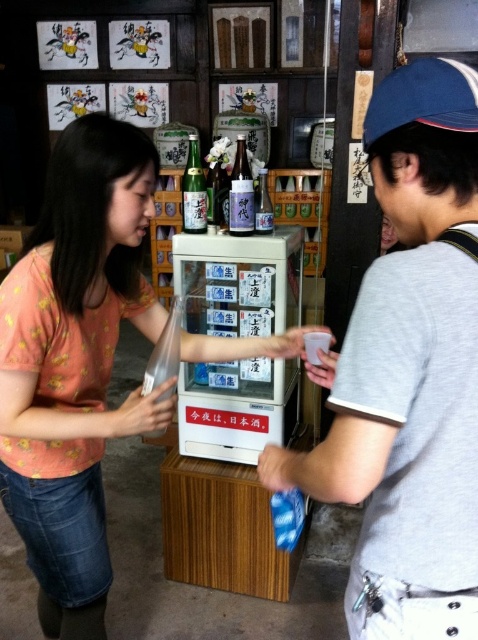
Question: Does matte glass bottle at center have a greater width compared to shiny silver bottle at center?

Choices:
 (A) yes
 (B) no

Answer: (B)

Question: Which point is farther to the camera?

Choices:
 (A) (458, 72)
 (B) (191, 189)
 (C) (421, 115)
 (D) (269, 195)

Answer: (D)

Question: Is gray cotton t-shirt at center to the left of shiny silver bottle at center from the viewer's perspective?

Choices:
 (A) no
 (B) yes

Answer: (A)

Question: Which point appears farthest from the camera in this image?

Choices:
 (A) (254, 195)
 (B) (123, 248)
 (C) (388, 131)

Answer: (A)

Question: Is matte pink shirt at center wider than matte glass bottle at center?

Choices:
 (A) no
 (B) yes

Answer: (B)

Question: Which object is farther from the camera taking this photo?

Choices:
 (A) shiny silver bottle at center
 (B) matte pink shirt at center
 (C) blue fabric baseball cap at upper right
 (D) matte glass bottle at center

Answer: (D)